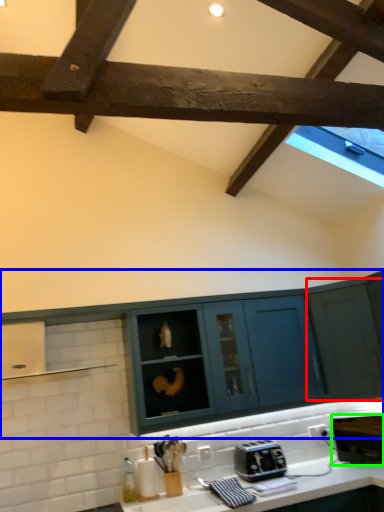
Question: Which object is positioned closest to cabinetry (highlighted by a red box)? Select from cabinetry (highlighted by a blue box) and appliance (highlighted by a green box).

Choices:
 (A) cabinetry
 (B) appliance

Answer: (A)